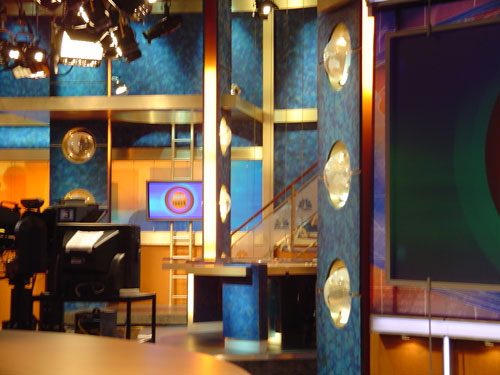
Locate an element on the screen. counter is located at coordinates (275, 273).